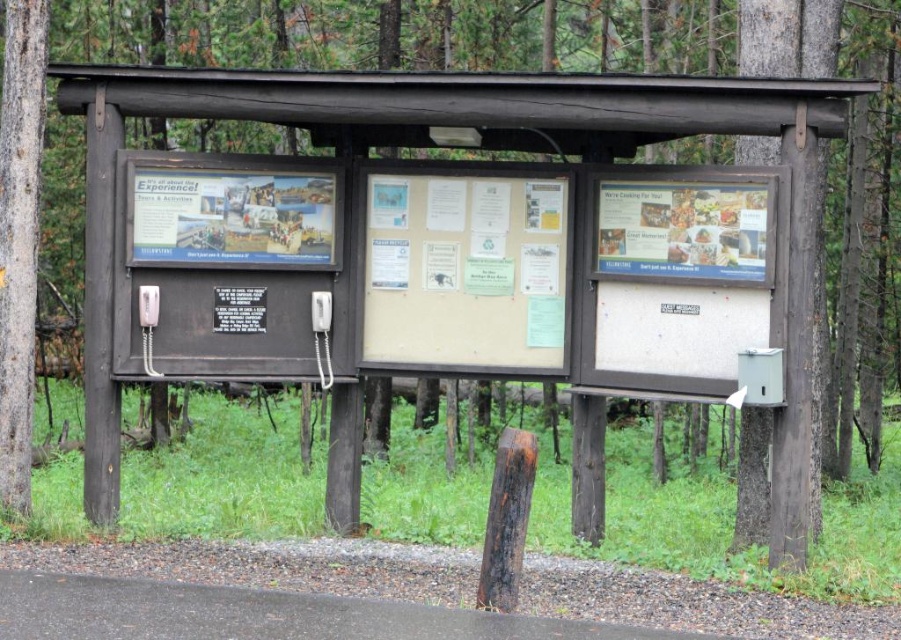
Which object is larger in size between the beige paperboard at center and the smooth gray bark at left?

The smooth gray bark at left is larger than the beige paperboard at center.

You are a hiker who needs to make an emergency call. You see the smooth gray bark at left and the white plastic payphone at center. Which object can you use to make a phone call?

The white plastic payphone at center is the correct choice for making a phone calls as it is a functional communication device, unlike the smooth gray bark at left which is part of a tree and cannot be used for communication purposes.

You are a hiker who wants to call for help using the white plastic payphone at center. However, you notice a smooth gray bark at left blocking your path. Can you reach the payphone without moving the bark?

The smooth gray bark at left is closer to the viewer than the white plastic payphone at center, so you would have to move the bark to access the payphone.